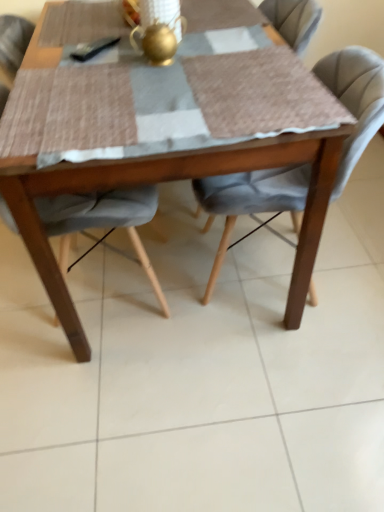
Find the location of a particular element. The image size is (384, 512). free space behind gold metallic teapot at center is located at coordinates (175, 47).